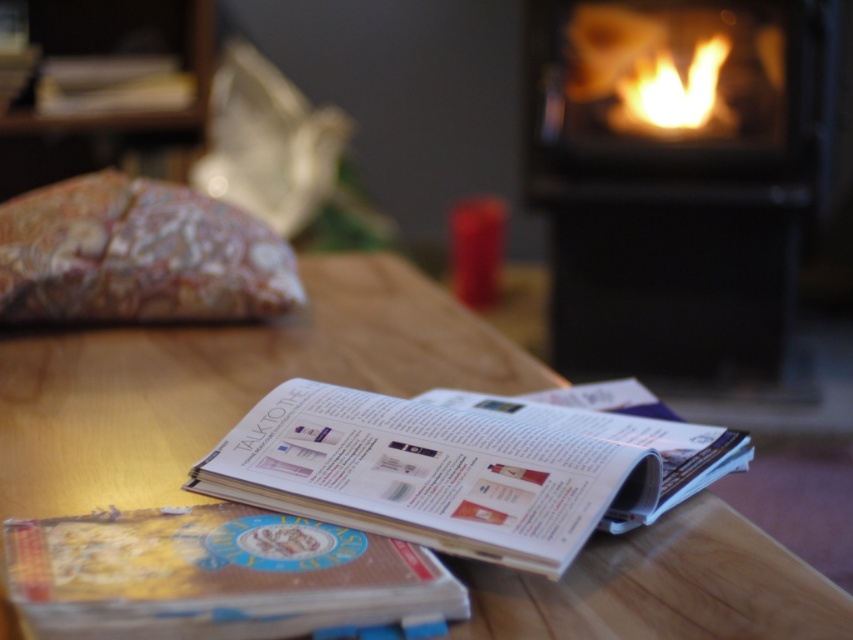
Where is `white glossy magazine at center`? This screenshot has height=640, width=853. white glossy magazine at center is located at coordinates (460, 468).

Does white glossy magazine at center have a larger size compared to flamematerial/texture at upper right?

No.

Is point (563, 476) less distant than point (757, 74)?

Yes, it is.

Where is `white glossy magazine at center`? The width and height of the screenshot is (853, 640). white glossy magazine at center is located at coordinates (460, 468).

Which is more to the right, wooden table at center or white glossy magazine at center?

From the viewer's perspective, white glossy magazine at center appears more on the right side.

The width and height of the screenshot is (853, 640). I want to click on wooden table at center, so click(223, 381).

The image size is (853, 640). What are the coordinates of `wooden table at center` in the screenshot? It's located at (223, 381).

Consider the image. Can you confirm if black glossy fireplace at upper right is positioned above flamematerial/texture at upper right?

No.

What do you see at coordinates (679, 186) in the screenshot?
I see `black glossy fireplace at upper right` at bounding box center [679, 186].

Locate an element on the screen. The width and height of the screenshot is (853, 640). black glossy fireplace at upper right is located at coordinates (679, 186).